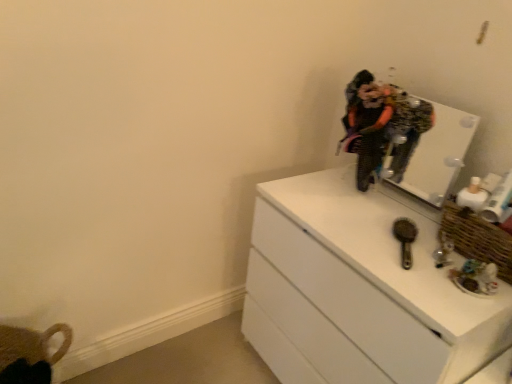
What is the approximate height of white glossy mirror at upper right?

The height of white glossy mirror at upper right is 13.49 inches.

This screenshot has width=512, height=384. I want to click on white glossy chest of drawers at right, so click(358, 291).

What is the approximate width of white glossy chest of drawers at right?

20.64 inches.

I want to click on textured black dress at center, so click(381, 126).

Describe the element at coordinates (405, 239) in the screenshot. The image size is (512, 384). I see `metallic brown brush at center-right` at that location.

The width and height of the screenshot is (512, 384). What do you see at coordinates (477, 238) in the screenshot? I see `woven brown basket at right` at bounding box center [477, 238].

At what (x,y) coordinates should I click in order to perform the action: click on woven brown basket at right. Please return your answer as a coordinate pair (x, y). Image resolution: width=512 pixels, height=384 pixels. Looking at the image, I should click on (477, 238).

I want to click on white glossy mirror at upper right, so click(436, 153).

From a real-world perspective, is metallic brown brush at center-right above or below woven brown basket at right?

metallic brown brush at center-right is situated lower than woven brown basket at right in the real world.

Choose the correct answer: Is metallic brown brush at center-right inside woven brown basket at right or outside it?

metallic brown brush at center-right lies outside woven brown basket at right.

Does metallic brown brush at center-right have a greater width compared to woven brown basket at right?

Yes, metallic brown brush at center-right is wider than woven brown basket at right.

This screenshot has height=384, width=512. Find the location of `mirror behind the white glossy chest of drawers at right`. mirror behind the white glossy chest of drawers at right is located at coordinates (436, 153).

Is white glossy mirror at upper right next to white glossy chest of drawers at right and touching it?

No, white glossy mirror at upper right is not next to white glossy chest of drawers at right.

Between white glossy mirror at upper right and white glossy chest of drawers at right, which one appears on the left side from the viewer's perspective?

white glossy chest of drawers at right.

Which point is more forward, [423,184] or [281,305]?

Point [281,305]

Which object is more forward, white glossy chest of drawers at right or white glossy mirror at upper right?

white glossy chest of drawers at right is in front.

Visually, is white glossy chest of drawers at right positioned to the left or to the right of white glossy mirror at upper right?

white glossy chest of drawers at right is positioned on white glossy mirror at upper right's left side.

From a real-world perspective, who is located lower, white glossy chest of drawers at right or white glossy mirror at upper right?

white glossy chest of drawers at right, from a real-world perspective.

Is white glossy chest of drawers at right positioned beyond the bounds of white glossy mirror at upper right?

Absolutely, white glossy chest of drawers at right is external to white glossy mirror at upper right.

Locate an element on the screen. basket on the right of the white glossy chest of drawers at right is located at coordinates (477, 238).

Does woven brown basket at right have a lesser height compared to white glossy chest of drawers at right?

Yes, woven brown basket at right is shorter than white glossy chest of drawers at right.

Is woven brown basket at right facing towards white glossy chest of drawers at right?

No.

Who is more distant, woven brown basket at right or white glossy chest of drawers at right?

Positioned behind is woven brown basket at right.

Which is more to the left, white glossy chest of drawers at right or woven brown basket at right?

From the viewer's perspective, white glossy chest of drawers at right appears more on the left side.

Does white glossy chest of drawers at right have a greater height compared to woven brown basket at right?

Yes, white glossy chest of drawers at right is taller than woven brown basket at right.

Can woven brown basket at right be found inside white glossy chest of drawers at right?

Actually, woven brown basket at right is outside white glossy chest of drawers at right.

Is white glossy chest of drawers at right turned away from woven brown basket at right?

white glossy chest of drawers at right does not have its back to woven brown basket at right.

Is textured black dress at center to the right of white glossy mirror at upper right from the viewer's perspective?

In fact, textured black dress at center is to the left of white glossy mirror at upper right.

Is textured black dress at center facing away from white glossy mirror at upper right?

That's not correct — textured black dress at center is not looking away from white glossy mirror at upper right.

From a real-world perspective, which object stands above the other?

textured black dress at center is physically above.

What's the angular difference between textured black dress at center and white glossy mirror at upper right's facing directions?

They differ by 7.96 degrees in their facing directions.

Can you confirm if textured black dress at center is thinner than woven brown basket at right?

Correct, the width of textured black dress at center is less than that of woven brown basket at right.

Could you tell me if textured black dress at center is turned towards woven brown basket at right?

No, textured black dress at center is not oriented towards woven brown basket at right.

Is woven brown basket at right located within textured black dress at center?

No.

Is there a large distance between textured black dress at center and woven brown basket at right?

textured black dress at center is actually quite close to woven brown basket at right.

In order to click on basket above the metallic brown brush at center-right (from the image's perspective) in this screenshot , I will do click(477, 238).

Locate an element on the screen. This screenshot has width=512, height=384. chest of drawers on the left of white glossy mirror at upper right is located at coordinates (358, 291).

Looking at the image, which one is located closer to white glossy mirror at upper right, textured black dress at center or woven brown basket at right?

textured black dress at center is positioned closer to the anchor white glossy mirror at upper right.

Estimate the real-world distances between objects in this image. Which object is further from white glossy chest of drawers at right, metallic brown brush at center-right or white glossy mirror at upper right?

white glossy mirror at upper right is further to white glossy chest of drawers at right.

From the image, which object appears to be nearer to white glossy mirror at upper right, woven brown basket at right or white glossy chest of drawers at right?

Among the two, white glossy chest of drawers at right is located nearer to white glossy mirror at upper right.

When comparing their distances from white glossy chest of drawers at right, does white glossy mirror at upper right or woven brown basket at right seem closer?

woven brown basket at right is positioned closer to the anchor white glossy chest of drawers at right.

Based on the photo, from the image, which object appears to be farther from textured black dress at center, white glossy mirror at upper right or metallic brown brush at center-right?

Based on the image, metallic brown brush at center-right appears to be further to textured black dress at center.

When comparing their distances from metallic brown brush at center-right, does textured black dress at center or white glossy mirror at upper right seem closer?

Among the two, textured black dress at center is located nearer to metallic brown brush at center-right.

Considering their positions, is textured black dress at center positioned further to woven brown basket at right than white glossy chest of drawers at right?

Among the two, textured black dress at center is located further to woven brown basket at right.

Looking at the image, which one is located closer to textured black dress at center, white glossy chest of drawers at right or white glossy mirror at upper right?

Among the two, white glossy mirror at upper right is located nearer to textured black dress at center.

I want to click on basket between white glossy mirror at upper right and metallic brown brush at center-right from top to bottom, so click(x=477, y=238).

Locate an element on the screen. This screenshot has height=384, width=512. basket between textured black dress at center and metallic brown brush at center-right in the vertical direction is located at coordinates pos(477,238).

Locate an element on the screen. This screenshot has width=512, height=384. brush between textured black dress at center and white glossy chest of drawers at right in the up-down direction is located at coordinates (405, 239).

This screenshot has width=512, height=384. In order to click on brush between woven brown basket at right and white glossy chest of drawers at right vertically in this screenshot , I will do `click(405, 239)`.